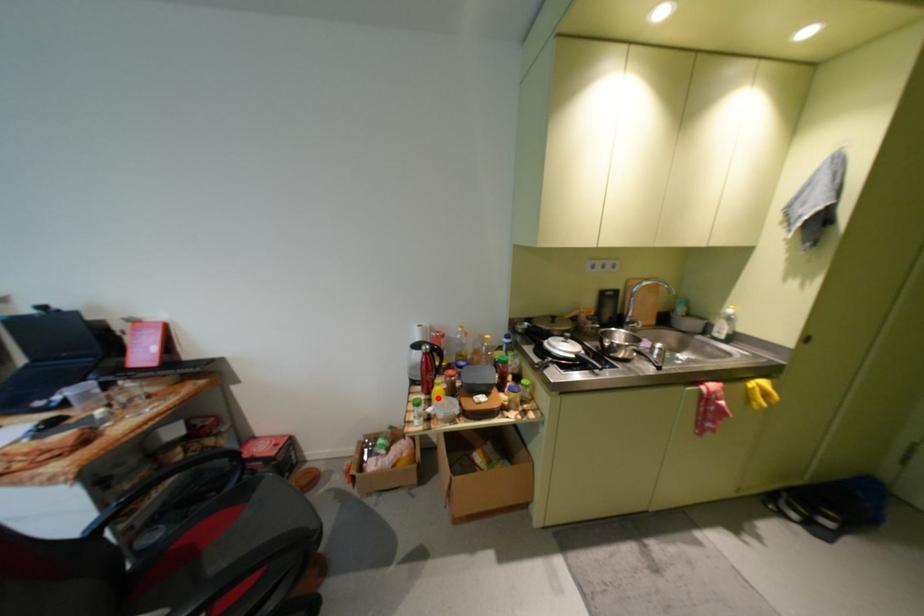
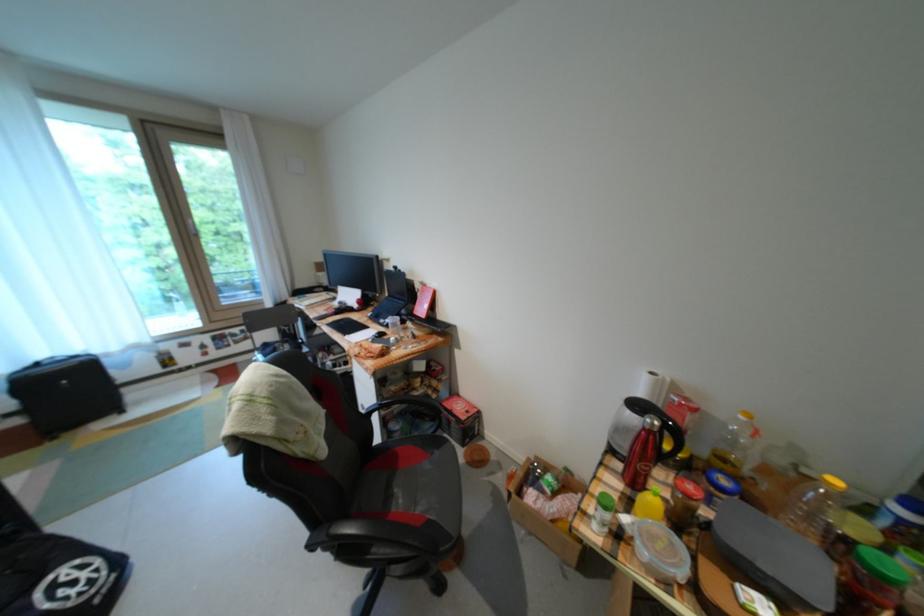
Find the pixel in the second image that matches the highlighted location in the first image.

(639, 493)